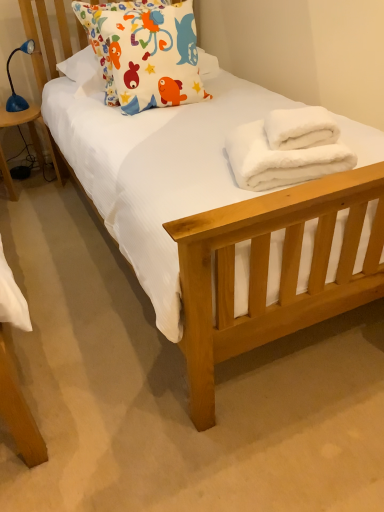
Locate an element on the screen. matte fabric pillow at upper left is located at coordinates (145, 52).

This screenshot has width=384, height=512. What do you see at coordinates (145, 52) in the screenshot?
I see `matte fabric pillow at upper left` at bounding box center [145, 52].

What is the approximate width of white fluffy bath towel at center, the 1th bath towel in the top-to-bottom sequence?

9.82 inches.

Find the location of `blue plastic lamp at left`. blue plastic lamp at left is located at coordinates (25, 123).

You are a GUI agent. You are given a task and a screenshot of the screen. Output one action in this format:
    pyautogui.click(x=<x>, y=<y>)
    Task: Click on the white fluffy bath towel at lower right, the first bath towel in the bottom-to-top sequence
    The image size is (384, 512).
    Given the screenshot: What is the action you would take?
    point(282,158)

Would you say matte fabric pillow at upper left contains white fluffy bath towel at center, the 1th bath towel in the top-to-bottom sequence?

No, white fluffy bath towel at center, the 1th bath towel in the top-to-bottom sequence, is not a part of matte fabric pillow at upper left.

Which object is further away from the camera, matte fabric pillow at upper left or white fluffy bath towel at center, the second bath towel positioned from the bottom?

matte fabric pillow at upper left is more distant.

The width and height of the screenshot is (384, 512). I want to click on the 1st bath towel below when counting from the matte fabric pillow at upper left (from the image's perspective), so click(300, 128).

Are white fluffy bath towel at center, the second bath towel positioned from the bottom, and white fluffy bath towel at lower right, placed as the 2th bath towel when sorted from top to bottom, located far from each other?

white fluffy bath towel at center, the second bath towel positioned from the bottom, is near white fluffy bath towel at lower right, placed as the 2th bath towel when sorted from top to bottom, not far away.

In terms of width, does white fluffy bath towel at center, the second bath towel positioned from the bottom, look wider or thinner when compared to white fluffy bath towel at lower right, the first bath towel in the bottom-to-top sequence?

Considering their sizes, white fluffy bath towel at center, the second bath towel positioned from the bottom, looks slimmer than white fluffy bath towel at lower right, the first bath towel in the bottom-to-top sequence.

What are the coordinates of `bath towel above the white fluffy bath towel at lower right, placed as the 2th bath towel when sorted from top to bottom (from a real-world perspective)` in the screenshot? It's located at (300, 128).

From the image's perspective, which object appears higher, white fluffy bath towel at center, the 1th bath towel in the top-to-bottom sequence, or white fluffy bath towel at lower right, placed as the 2th bath towel when sorted from top to bottom?

white fluffy bath towel at center, the 1th bath towel in the top-to-bottom sequence, from the image's perspective.

Considering their positions, is white fluffy bath towel at lower right, placed as the 2th bath towel when sorted from top to bottom, located in front of or behind matte fabric pillow at upper left?

Clearly, white fluffy bath towel at lower right, placed as the 2th bath towel when sorted from top to bottom, is in front of matte fabric pillow at upper left.

From a real-world perspective, relative to matte fabric pillow at upper left, is white fluffy bath towel at lower right, placed as the 2th bath towel when sorted from top to bottom, vertically above or below?

Clearly, from a real-world perspective, white fluffy bath towel at lower right, placed as the 2th bath towel when sorted from top to bottom, is below matte fabric pillow at upper left.

From the image's perspective, is white fluffy bath towel at lower right, the first bath towel in the bottom-to-top sequence, over matte fabric pillow at upper left?

Incorrect, from the image's perspective, white fluffy bath towel at lower right, the first bath towel in the bottom-to-top sequence, is lower than matte fabric pillow at upper left.

Would you say white fluffy bath towel at lower right, placed as the 2th bath towel when sorted from top to bottom, contains matte fabric pillow at upper left?

No.

Is blue plastic lamp at left in front of or behind white fluffy bath towel at lower right, placed as the 2th bath towel when sorted from top to bottom, in the image?

Visually, blue plastic lamp at left is located behind white fluffy bath towel at lower right, placed as the 2th bath towel when sorted from top to bottom.

Is point (33, 42) closer or farther from the camera than point (233, 138)?

Point (33, 42) is farther from the camera than point (233, 138).

Is the surface of blue plastic lamp at left in direct contact with white fluffy bath towel at lower right, placed as the 2th bath towel when sorted from top to bottom?

No, blue plastic lamp at left is not beside white fluffy bath towel at lower right, placed as the 2th bath towel when sorted from top to bottom.

Which is more to the left, blue plastic lamp at left or white fluffy bath towel at lower right, the first bath towel in the bottom-to-top sequence?

blue plastic lamp at left is more to the left.

Is blue plastic lamp at left behind matte fabric pillow at upper left?

Yes, blue plastic lamp at left is behind matte fabric pillow at upper left.

Which object is thinner, blue plastic lamp at left or matte fabric pillow at upper left?

matte fabric pillow at upper left is thinner.

Who is smaller, blue plastic lamp at left or matte fabric pillow at upper left?

blue plastic lamp at left.

Visually, is blue plastic lamp at left positioned to the left or to the right of matte fabric pillow at upper left?

Based on their positions, blue plastic lamp at left is located to the left of matte fabric pillow at upper left.

How different are the orientations of matte fabric pillow at upper left and blue plastic lamp at left in degrees?

34.7 degrees.

Is matte fabric pillow at upper left spatially inside blue plastic lamp at left, or outside of it?

matte fabric pillow at upper left lies outside blue plastic lamp at left.

Considering the sizes of objects matte fabric pillow at upper left and blue plastic lamp at left in the image provided, who is bigger, matte fabric pillow at upper left or blue plastic lamp at left?

matte fabric pillow at upper left is bigger.

Is matte fabric pillow at upper left oriented towards blue plastic lamp at left?

No, matte fabric pillow at upper left is not oriented towards blue plastic lamp at left.

From a real-world perspective, is matte fabric pillow at upper left above or below blue plastic lamp at left?

matte fabric pillow at upper left is situated higher than blue plastic lamp at left in the real world.

Who is shorter, matte fabric pillow at upper left or blue plastic lamp at left?

blue plastic lamp at left.

Is matte fabric pillow at upper left positioned beyond the bounds of blue plastic lamp at left?

Yes.

Which is more to the right, matte fabric pillow at upper left or blue plastic lamp at left?

Positioned to the right is matte fabric pillow at upper left.

The height and width of the screenshot is (512, 384). Identify the location of pillow that is above the white fluffy bath towel at center, the 1th bath towel in the top-to-bottom sequence (from the image's perspective). [x=145, y=52].

The image size is (384, 512). Find the location of `bath towel that is on the left side of white fluffy bath towel at center, the 1th bath towel in the top-to-bottom sequence`. bath towel that is on the left side of white fluffy bath towel at center, the 1th bath towel in the top-to-bottom sequence is located at coordinates (282, 158).

From the picture: Based on their spatial positions, is blue plastic lamp at left or matte fabric pillow at upper left closer to blue plastic lamp at left?

Among the two, blue plastic lamp at left is located nearer to blue plastic lamp at left.

Looking at the image, which one is located closer to blue plastic lamp at left, white fluffy bath towel at center, the 1th bath towel in the top-to-bottom sequence, or white fluffy bath towel at lower right, placed as the 2th bath towel when sorted from top to bottom?

white fluffy bath towel at lower right, placed as the 2th bath towel when sorted from top to bottom, lies closer to blue plastic lamp at left than the other object.

Which object lies further to the anchor point blue plastic lamp at left, matte fabric pillow at upper left or white fluffy bath towel at lower right, the first bath towel in the bottom-to-top sequence?

The object further to blue plastic lamp at left is white fluffy bath towel at lower right, the first bath towel in the bottom-to-top sequence.

Considering their positions, is matte fabric pillow at upper left positioned further to white fluffy bath towel at lower right, the first bath towel in the bottom-to-top sequence, than white fluffy bath towel at center, the 1th bath towel in the top-to-bottom sequence?

Among the two, matte fabric pillow at upper left is located further to white fluffy bath towel at lower right, the first bath towel in the bottom-to-top sequence.

Considering their positions, is blue plastic lamp at left positioned closer to blue plastic lamp at left than white fluffy bath towel at center, the 1th bath towel in the top-to-bottom sequence?

blue plastic lamp at left is closer to blue plastic lamp at left.

Considering their positions, is white fluffy bath towel at center, the second bath towel positioned from the bottom, positioned further to matte fabric pillow at upper left than white fluffy bath towel at lower right, placed as the 2th bath towel when sorted from top to bottom?

Among the two, white fluffy bath towel at center, the second bath towel positioned from the bottom, is located further to matte fabric pillow at upper left.

Looking at the image, which one is located closer to white fluffy bath towel at lower right, placed as the 2th bath towel when sorted from top to bottom, blue plastic lamp at left or white fluffy bath towel at center, the second bath towel positioned from the bottom?

white fluffy bath towel at center, the second bath towel positioned from the bottom, lies closer to white fluffy bath towel at lower right, placed as the 2th bath towel when sorted from top to bottom, than the other object.

Looking at the image, which one is located further to white fluffy bath towel at lower right, the first bath towel in the bottom-to-top sequence, matte fabric pillow at upper left or blue plastic lamp at left?

Among the two, blue plastic lamp at left is located further to white fluffy bath towel at lower right, the first bath towel in the bottom-to-top sequence.

The width and height of the screenshot is (384, 512). Find the location of `lamp located between blue plastic lamp at left and white fluffy bath towel at center, the second bath towel positioned from the bottom, in the left-right direction`. lamp located between blue plastic lamp at left and white fluffy bath towel at center, the second bath towel positioned from the bottom, in the left-right direction is located at coordinates (12, 82).

Find the location of a particular element. pillow situated between blue plastic lamp at left and white fluffy bath towel at lower right, the first bath towel in the bottom-to-top sequence, from left to right is located at coordinates (145, 52).

Where is `lamp situated between blue plastic lamp at left and white fluffy bath towel at lower right, placed as the 2th bath towel when sorted from top to bottom, from left to right`? lamp situated between blue plastic lamp at left and white fluffy bath towel at lower right, placed as the 2th bath towel when sorted from top to bottom, from left to right is located at coordinates (12, 82).

Locate an element on the screen. pillow between blue plastic lamp at left and white fluffy bath towel at lower right, the first bath towel in the bottom-to-top sequence is located at coordinates pos(145,52).